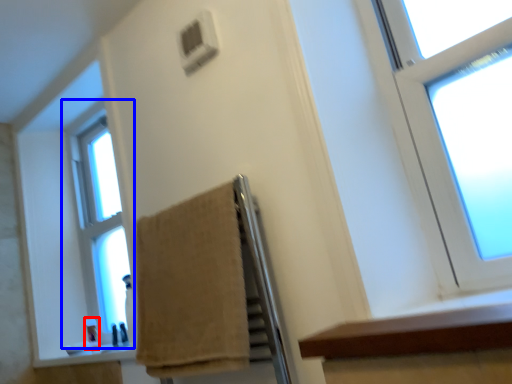
Question: Among these objects, which one is farthest to the camera, toiletry (highlighted by a red box) or window (highlighted by a blue box)?

Choices:
 (A) toiletry
 (B) window

Answer: (B)